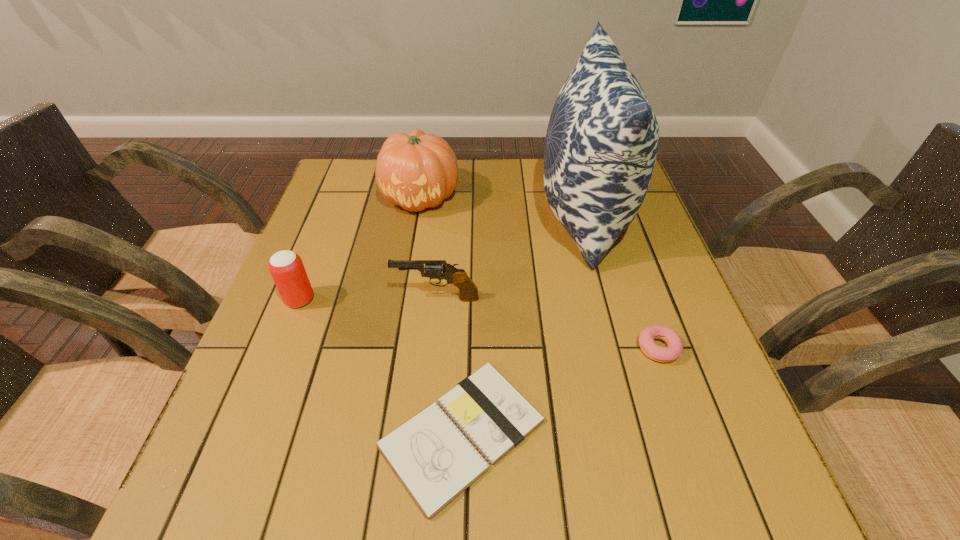
You are a GUI agent. You are given a task and a screenshot of the screen. Output one action in this format:
    pyautogui.click(x=<x>, y=<y>)
    Task: Click on the tallest object
    
    Given the screenshot: What is the action you would take?
    pyautogui.click(x=602, y=140)

Where is `the fifth shortest object`? the fifth shortest object is located at coordinates (417, 170).

Find the location of a particular element. beer can is located at coordinates click(286, 267).

Where is `gun`? The height and width of the screenshot is (540, 960). gun is located at coordinates (434, 269).

You are a GUI agent. You are given a task and a screenshot of the screen. Output one action in this format:
    pyautogui.click(x=<x>, y=<y>)
    Task: Click on the second shortest object
    This screenshot has height=540, width=960.
    Given the screenshot: What is the action you would take?
    pyautogui.click(x=646, y=338)

At what (x,y) coordinates should I click in order to perform the action: click on the shortest object. Please return your answer as a coordinate pair (x, y). Looking at the image, I should click on (435, 462).

Find the location of a particular element. Image resolution: width=960 pixels, height=540 pixels. vacant space located on the front surface of the cushion is located at coordinates (415, 215).

Image resolution: width=960 pixels, height=540 pixels. I want to click on vacant position located 0.400m on the front surface of the cushion, so click(389, 215).

Locate an element on the screen. This screenshot has width=960, height=540. vacant space located 0.070m on the front surface of the cushion is located at coordinates (512, 215).

Locate an element on the screen. The height and width of the screenshot is (540, 960). free space located on the carved face of the pumpkin is located at coordinates (409, 267).